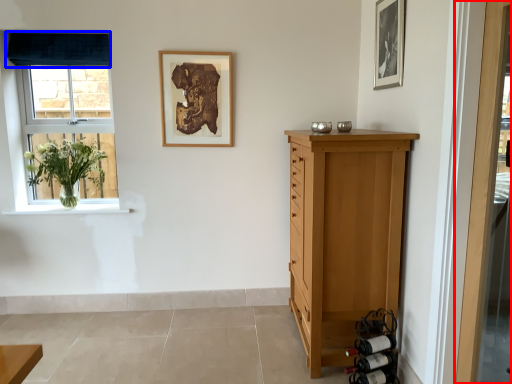
Question: Which of the following is the closest to the observer, door (highlighted by a red box) or curtain (highlighted by a blue box)?

Choices:
 (A) door
 (B) curtain

Answer: (A)